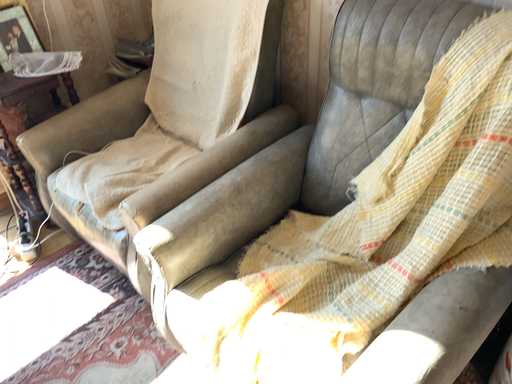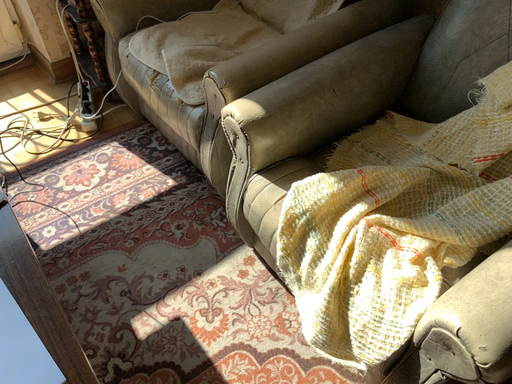
Question: How did the camera likely rotate when shooting the video?

Choices:
 (A) rotated downward
 (B) rotated upward

Answer: (A)